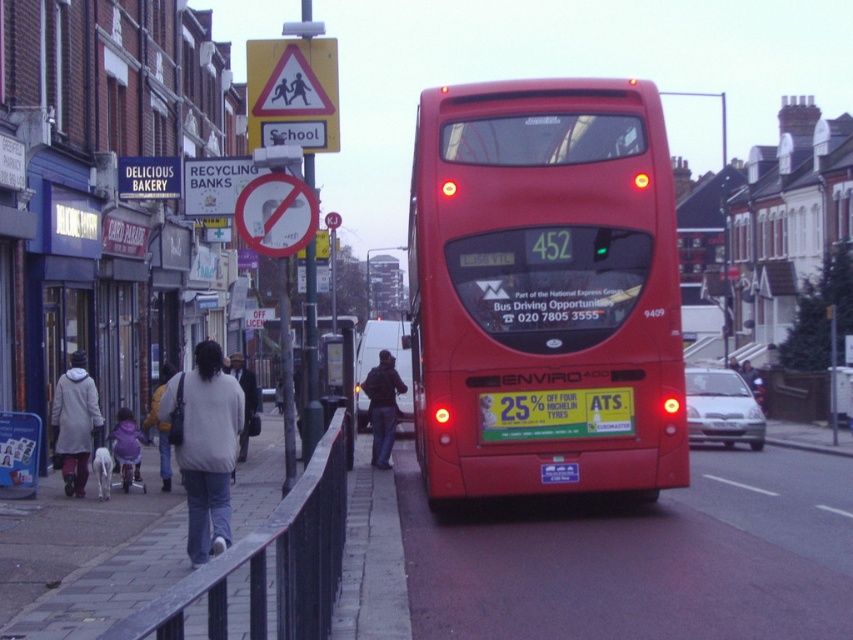
You are a pedestrian standing on the sidewalk and see the dark blue jeans at center and the light gray sweater at lower left. Which item is positioned higher in the image?

The dark blue jeans at center is located above the light gray sweater at lower left, so it is positioned higher in the image.

You are a pedestrian standing on the sidewalk. You see the yellow plastic school crossing sign at upper center and the light gray sweater at lower left. Which object is higher from the ground?

The yellow plastic school crossing sign at upper center is above the light gray sweater at lower left, so it is higher from the ground.

You are standing at the point with coordinates point (149, 412) and want to walk to the point with coordinates point (265, 122). Which direction should you move in?

You should move forward because point (265, 122) is in front of point (149, 412).